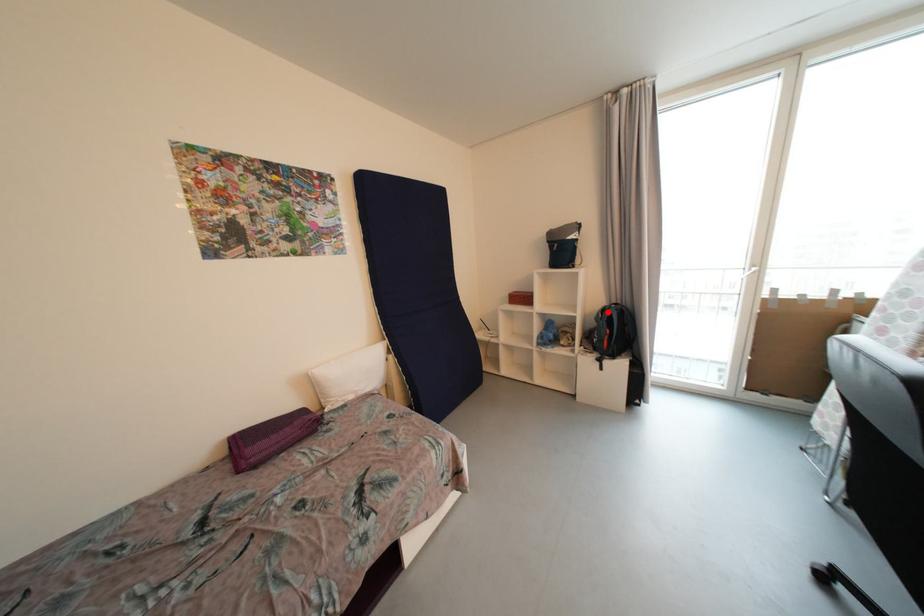
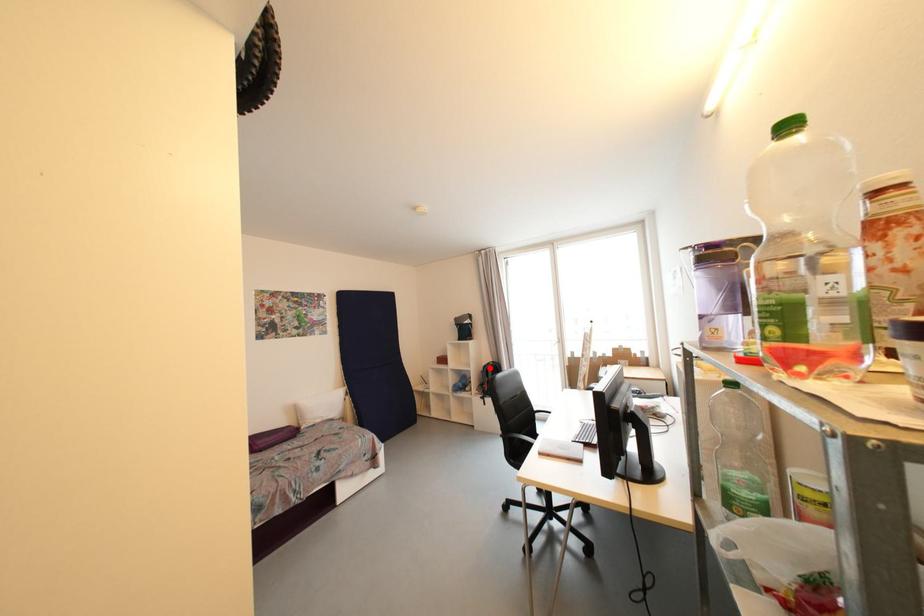
I am providing you with two images of the same scene from different viewpoints. A red point is marked on the first image and another point is marked on the second image. Does the point marked in image1 correspond to the same location as the one in image2?

Yes